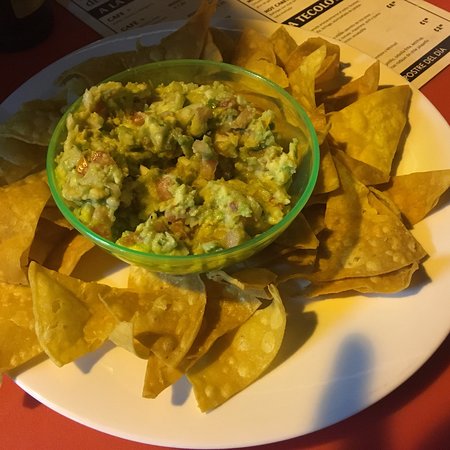
This screenshot has height=450, width=450. Find the location of `menu`. menu is located at coordinates (x=368, y=37).